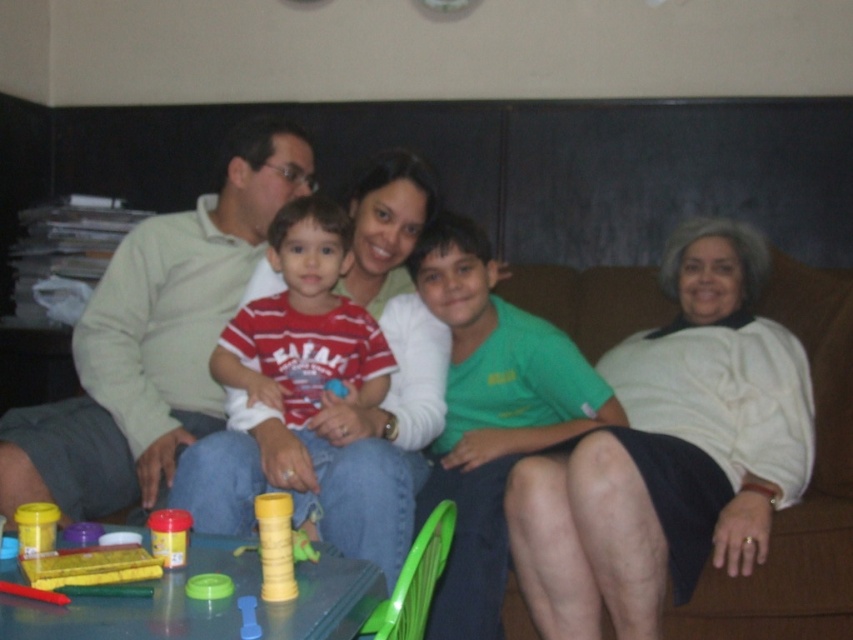
You are trying to place a new decorative item on the living room couch where the white sweater at center and the plastic toy at lower left are located. If you want to ensure the new item fits without overlapping either, which object should you consider the space next to for placement?

The white sweater at center is wider than the plastic toy at lower left, so you should consider placing the new item next to the plastic toy at lower left to ensure there is enough space.

Based on the photo, you are a photographer taking a picture of the scene. You notice the white sweater at center and the matte yellow cup at lower left. Which object should you focus on first if you want to capture both in the same frame without adjusting your camera settings, considering their sizes?

The white sweater at center is taller than the matte yellow cup at lower left, so you should focus on the white sweater at center first to ensure it fits within the frame, as it is larger.

What is located at the coordinates point (670, 451) in the image?

The white sweater at center is located at point (670, 451).